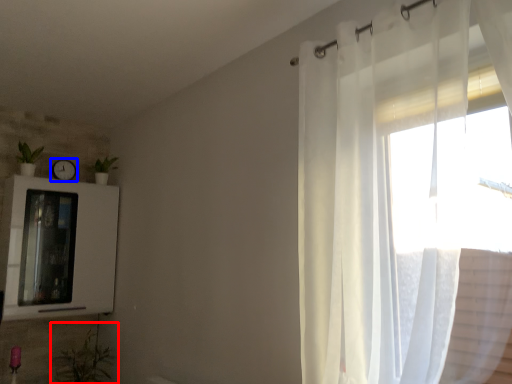
Question: Which object appears closest to the camera in this image, plant (highlighted by a red box) or clock (highlighted by a blue box)?

Choices:
 (A) plant
 (B) clock

Answer: (A)